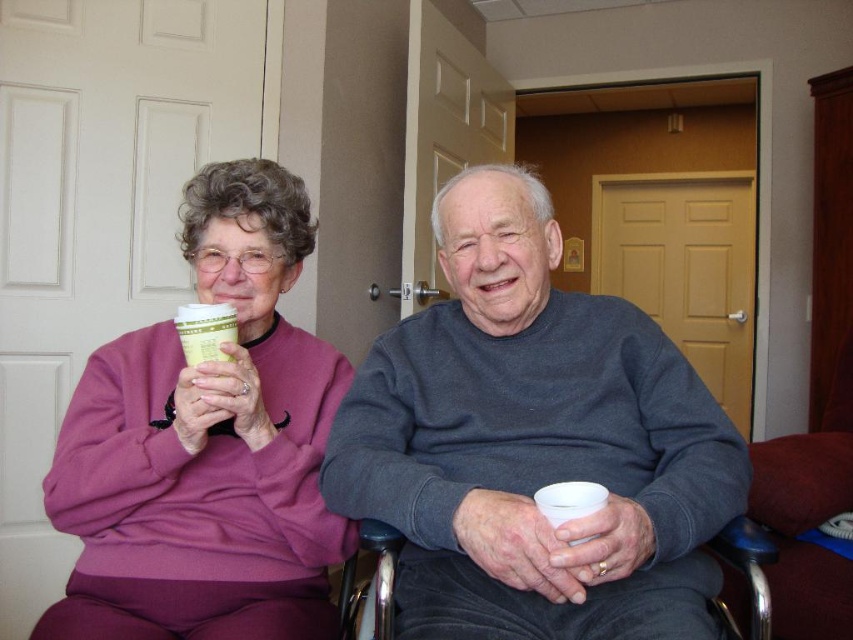
You are a delivery person who needs to place a package on the floor near the matte purple sweater at upper left. According to the coordinates provided, where should you place the package?

The matte purple sweater at upper left is located at coordinates point (206, 445), so you should place the package near that position.

Please provide the coordinates of the gray sweater at center in the image. The answer should be in the format of coordinates in parentheses.

The coordinates of the gray sweater at center are at point (534,444).

You are a delivery person who needs to place a small package between the matte purple sweater at upper left and the green paper cup at upper left. Can you fit it there?

The distance between the matte purple sweater at upper left and the green paper cup at upper left is 7.28 inches. If the small package is smaller than 7.28 inches in length, it can fit between them.